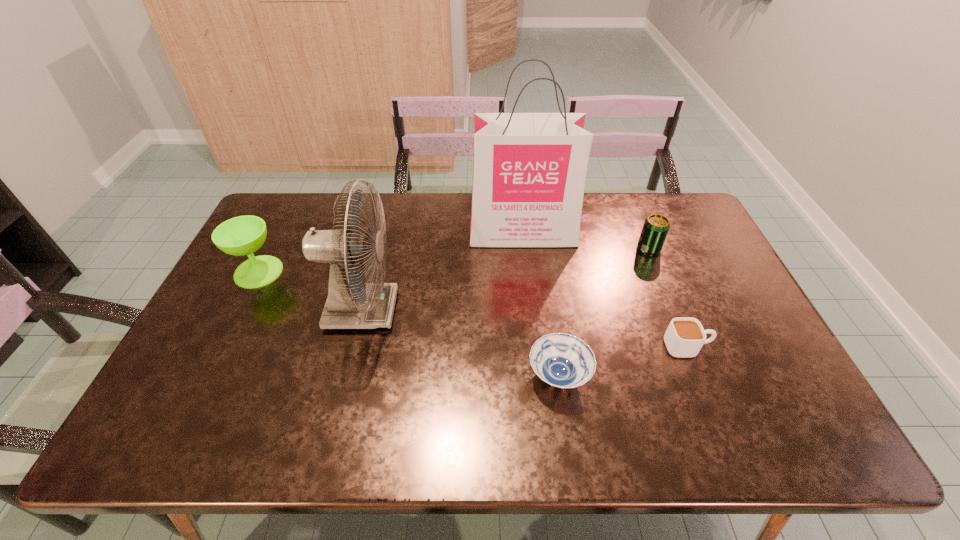
The width and height of the screenshot is (960, 540). Identify the location of free location located 0.360m on the front of the leftmost object. (194, 399).

The height and width of the screenshot is (540, 960). I want to click on vacant space situated 0.050m on the right of the fourth tallest object, so click(676, 248).

The height and width of the screenshot is (540, 960). I want to click on free space located 0.120m on the side with the handle of the cup, so click(x=756, y=347).

Identify the location of vacant space located on the right of the soup bowl. The width and height of the screenshot is (960, 540). (635, 375).

The image size is (960, 540). What are the coordinates of `object that is at the far edge` in the screenshot? It's located at (529, 171).

Identify the location of object at the left edge. This screenshot has width=960, height=540. (239, 236).

Locate an element on the screen. This screenshot has height=540, width=960. object that is at the right edge is located at coordinates (685, 336).

Identify the location of vacant region at the far edge of the desktop. This screenshot has height=540, width=960. (643, 206).

Where is `free point at the left edge`? free point at the left edge is located at coordinates click(265, 312).

Locate an element on the screen. This screenshot has height=540, width=960. vacant space at the right edge is located at coordinates (726, 291).